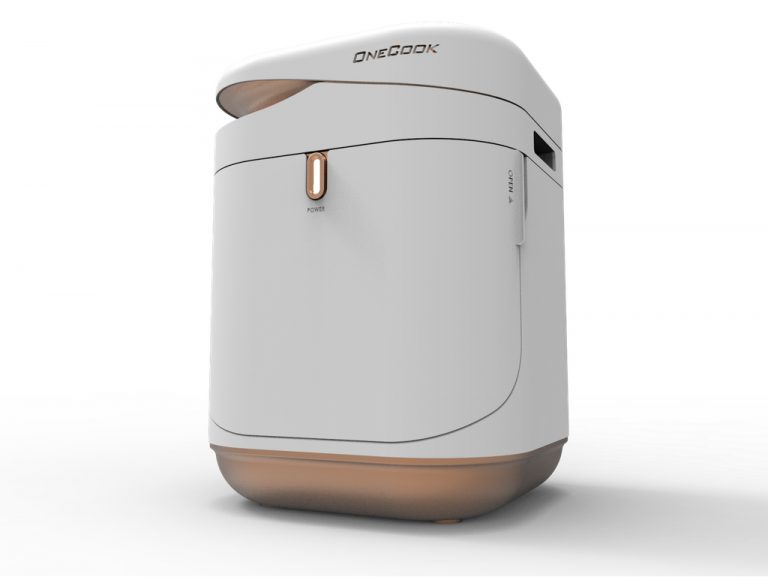
This screenshot has width=768, height=577. I want to click on counter, so click(525, 539).